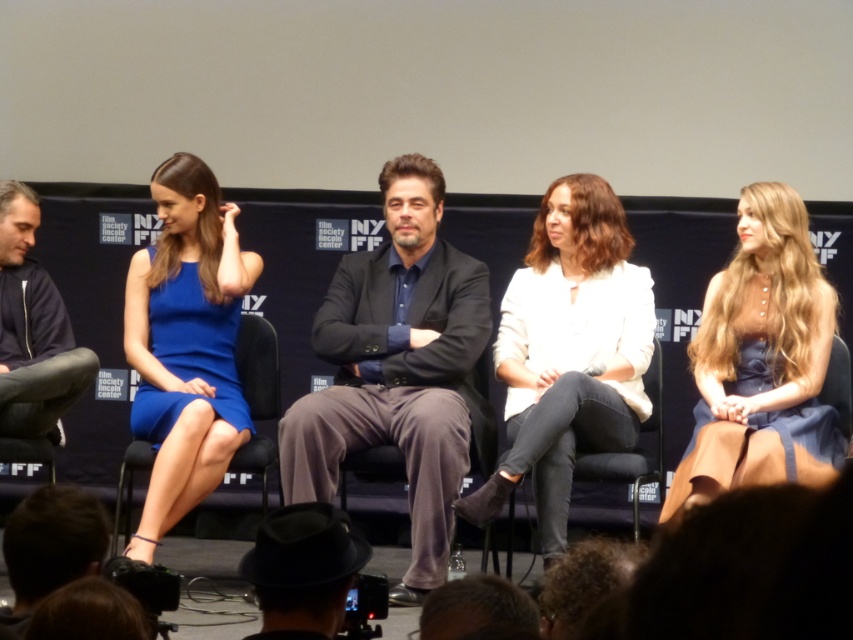
Question: Which object is the farthest from the matte blue dress at right?

Choices:
 (A) dark blue zip-up jacket at left
 (B) blue satin dress at left
 (C) white matte blazer at center
 (D) dark gray suit at center

Answer: (A)

Question: Which is farther from the denim at center?

Choices:
 (A) blue satin dress at left
 (B) matte blue dress at right

Answer: (A)

Question: Is white matte blazer at center below denim at center?

Choices:
 (A) yes
 (B) no

Answer: (B)

Question: Estimate the real-world distances between objects in this image. Which object is closer to the white matte blazer at center?

Choices:
 (A) blue satin dress at left
 (B) matte blue dress at right
 (C) denim at center

Answer: (C)

Question: Does white matte blazer at center appear on the right side of dark blue zip-up jacket at left?

Choices:
 (A) no
 (B) yes

Answer: (B)

Question: Can you confirm if dark gray suit at center is smaller than denim at center?

Choices:
 (A) yes
 (B) no

Answer: (B)